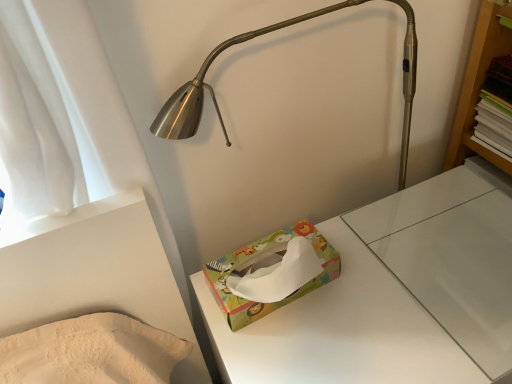
Question: Considering the relative sizes of multicolored paper tissue box at center and multicolored paper tissue box at center in the image provided, is multicolored paper tissue box at center taller than multicolored paper tissue box at center?

Choices:
 (A) yes
 (B) no

Answer: (B)

Question: Is multicolored paper tissue box at center not near multicolored paper tissue box at center?

Choices:
 (A) no
 (B) yes

Answer: (A)

Question: Does multicolored paper tissue box at center appear on the left side of multicolored paper tissue box at center?

Choices:
 (A) yes
 (B) no

Answer: (A)

Question: From a real-world perspective, is multicolored paper tissue box at center beneath multicolored paper tissue box at center?

Choices:
 (A) yes
 (B) no

Answer: (B)

Question: Considering the relative sizes of multicolored paper tissue box at center and multicolored paper tissue box at center in the image provided, is multicolored paper tissue box at center wider than multicolored paper tissue box at center?

Choices:
 (A) no
 (B) yes

Answer: (A)

Question: Is the depth of multicolored paper tissue box at center greater than that of multicolored paper tissue box at center?

Choices:
 (A) yes
 (B) no

Answer: (A)

Question: Could you tell me if multicolored paper tissue box at center is facing multicolored paper tissue box at center?

Choices:
 (A) no
 (B) yes

Answer: (A)

Question: Does multicolored paper tissue box at center come in front of multicolored paper tissue box at center?

Choices:
 (A) yes
 (B) no

Answer: (A)

Question: Is multicolored paper tissue box at center positioned with its back to multicolored paper tissue box at center?

Choices:
 (A) yes
 (B) no

Answer: (B)

Question: From the image's perspective, is multicolored paper tissue box at center under multicolored paper tissue box at center?

Choices:
 (A) no
 (B) yes

Answer: (B)

Question: Does multicolored paper tissue box at center appear on the left side of multicolored paper tissue box at center?

Choices:
 (A) no
 (B) yes

Answer: (A)

Question: Is the position of multicolored paper tissue box at center more distant than that of multicolored paper tissue box at center?

Choices:
 (A) yes
 (B) no

Answer: (B)

Question: Considering the positions of multicolored paper tissue box at center and multicolored paper tissue box at center in the image, is multicolored paper tissue box at center taller or shorter than multicolored paper tissue box at center?

Choices:
 (A) tall
 (B) short

Answer: (A)